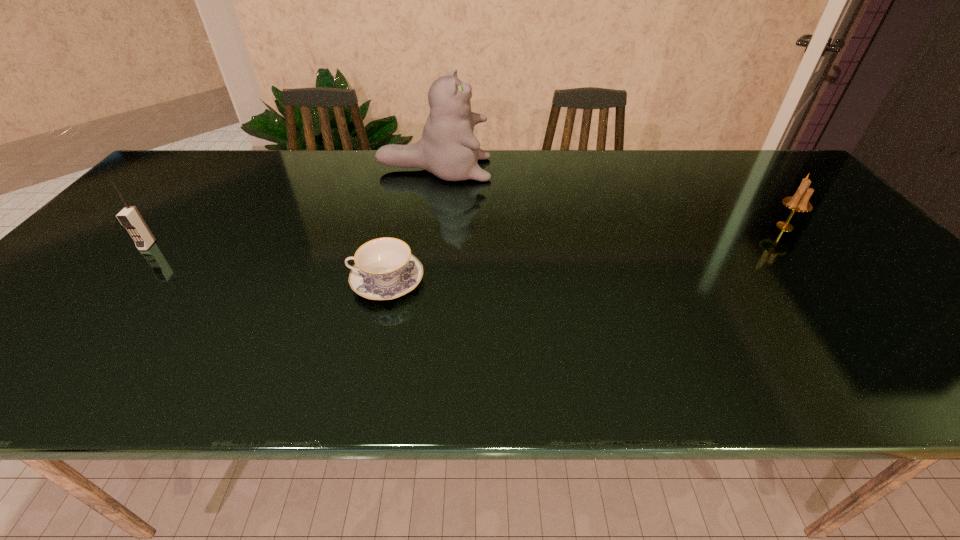
Locate an element on the screen. empty location between the leftmost object and the farthest object is located at coordinates (291, 207).

The image size is (960, 540). I want to click on vacant region between the cellular telephone and the rightmost object, so click(467, 236).

This screenshot has width=960, height=540. I want to click on vacant area that lies between the rightmost object and the cat, so click(610, 198).

Where is `free space between the cat and the chinaware`? The height and width of the screenshot is (540, 960). free space between the cat and the chinaware is located at coordinates (410, 225).

Where is `free space between the chinaware and the tallest object`? The image size is (960, 540). free space between the chinaware and the tallest object is located at coordinates (410, 225).

Find the location of a particular element. vacant region between the nearest object and the leftmost object is located at coordinates (267, 264).

You are a GUI agent. You are given a task and a screenshot of the screen. Output one action in this format:
    pyautogui.click(x=<x>, y=<y>)
    Task: Click on the vacant area that lies between the cat and the shortest object
    This screenshot has height=540, width=960.
    Given the screenshot: What is the action you would take?
    pyautogui.click(x=410, y=225)

Locate an element on the screen. This screenshot has width=960, height=540. empty location between the chinaware and the rightmost object is located at coordinates (586, 254).

Find the location of a particular element. The image size is (960, 540). free area in between the third farthest object and the tallest object is located at coordinates (291, 207).

Locate an element on the screen. This screenshot has height=540, width=960. unoccupied area between the rightmost object and the shortest object is located at coordinates tap(586, 254).